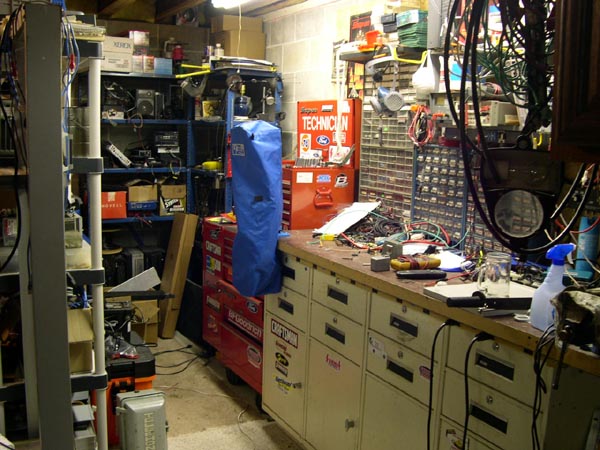
This screenshot has width=600, height=450. Find the location of `white cabinet drawers`. white cabinet drawers is located at coordinates point(402,323), point(402,371), point(480,413), point(488,365), point(333,335), point(336,297), point(290,275), point(287,305).